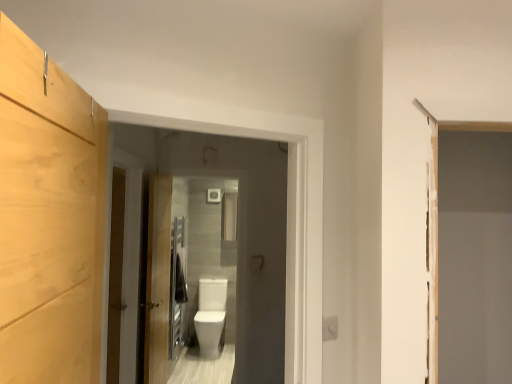
The image size is (512, 384). What do you see at coordinates (158, 279) in the screenshot? I see `wooden door at center, arranged as the first door when viewed from the back` at bounding box center [158, 279].

You are a GUI agent. You are given a task and a screenshot of the screen. Output one action in this format:
    pyautogui.click(x=<x>, y=<y>)
    Task: Click on the wooden door at center, the second door viewed from the left
    Image resolution: width=512 pixels, height=384 pixels.
    Given the screenshot: What is the action you would take?
    pyautogui.click(x=158, y=279)

Describe the element at coordinates (130, 260) in the screenshot. I see `wooden door at center, acting as the second door starting from the right` at that location.

What is the approximate width of wooden door at center, placed as the first door when sorted from left to right?

wooden door at center, placed as the first door when sorted from left to right, is 3.94 inches in width.

Image resolution: width=512 pixels, height=384 pixels. Describe the element at coordinates (238, 229) in the screenshot. I see `white glossy toilet at center` at that location.

Find the location of a particular element. The width and height of the screenshot is (512, 384). wooden door at center, arranged as the first door when viewed from the back is located at coordinates (158, 279).

Is wooden door at center, the first door positioned from the right, oriented away from light wood cabinet at left?

No, wooden door at center, the first door positioned from the right, is not facing away from light wood cabinet at left.

Measure the distance from wooden door at center, the second door viewed from the left, to light wood cabinet at left.

They are 2.21 meters apart.

Are wooden door at center, the first door positioned from the right, and light wood cabinet at left making contact?

No, wooden door at center, the first door positioned from the right, is not beside light wood cabinet at left.

Where is `cabinetry on the right of wooden door at center, the second door viewed from the left`? The image size is (512, 384). cabinetry on the right of wooden door at center, the second door viewed from the left is located at coordinates (49, 218).

Measure the distance from wooden door at center, the second door viewed from the left, to white glossy toilet at center.

They are 23.95 inches apart.

From their relative heights in the image, would you say wooden door at center, arranged as the first door when viewed from the back, is taller or shorter than white glossy toilet at center?

In the image, wooden door at center, arranged as the first door when viewed from the back, appears to be taller than white glossy toilet at center.

From a real-world perspective, is wooden door at center, the second door viewed from the left, located beneath white glossy toilet at center?

Yes, from a real-world perspective, wooden door at center, the second door viewed from the left, is below white glossy toilet at center.

Could you tell me if wooden door at center, the second door viewed from the left, is facing white glossy toilet at center?

No, wooden door at center, the second door viewed from the left, is not oriented towards white glossy toilet at center.

Who is shorter, light wood cabinet at left or wooden door at center, acting as the second door starting from the right?

light wood cabinet at left.

Is light wood cabinet at left thinner than wooden door at center, acting as the 1th door starting from the front?

Incorrect, the width of light wood cabinet at left is not less than that of wooden door at center, acting as the 1th door starting from the front.

Considering the sizes of light wood cabinet at left and wooden door at center, which appears as the second door when viewed from the back, in the image, is light wood cabinet at left bigger or smaller than wooden door at center, which appears as the second door when viewed from the back,?

light wood cabinet at left is smaller than wooden door at center, which appears as the second door when viewed from the back.

In terms of height, does wooden door at center, placed as the first door when sorted from left to right, look taller or shorter compared to wooden door at center, which is counted as the second door, starting from the front?

In the image, wooden door at center, placed as the first door when sorted from left to right, appears to be shorter than wooden door at center, which is counted as the second door, starting from the front.

Could you tell me if wooden door at center, acting as the second door starting from the right, is facing wooden door at center, which is counted as the second door, starting from the front?

No.

Looking at the image, does wooden door at center, which appears as the second door when viewed from the back, seem bigger or smaller compared to wooden door at center, arranged as the first door when viewed from the back?

wooden door at center, which appears as the second door when viewed from the back, is smaller than wooden door at center, arranged as the first door when viewed from the back.

Which point is more distant from viewer, [137,194] or [161,371]?

The point [161,371] is farther from the camera.

Considering the positions of point (20, 247) and point (212, 332), is point (20, 247) closer or farther from the camera than point (212, 332)?

Point (20, 247) is positioned closer to the camera compared to point (212, 332).

Considering the relative sizes of light wood cabinet at left and white glossy toilet bowl at center in the image provided, is light wood cabinet at left smaller than white glossy toilet bowl at center?

Yes, light wood cabinet at left is smaller than white glossy toilet bowl at center.

From a real-world perspective, which is physically above, light wood cabinet at left or white glossy toilet bowl at center?

light wood cabinet at left.

Is light wood cabinet at left not near white glossy toilet bowl at center?

Yes, light wood cabinet at left is far from white glossy toilet bowl at center.

Is wooden door at center, arranged as the first door when viewed from the back, completely or partially outside of wooden barn door at left?

That's correct, wooden door at center, arranged as the first door when viewed from the back, is outside of wooden barn door at left.

Is wooden door at center, arranged as the first door when viewed from the back, at the right side of wooden barn door at left?

Yes, wooden door at center, arranged as the first door when viewed from the back, is to the right of wooden barn door at left.

Which is in front, wooden door at center, the first door positioned from the right, or wooden barn door at left?

Positioned in front is wooden barn door at left.

Which is more to the left, white glossy toilet at center or wooden barn door at left?

wooden barn door at left is more to the left.

Consider the image. From the image's perspective, which one is positioned higher, white glossy toilet at center or wooden barn door at left?

white glossy toilet at center appears higher in the image.

From a real-world perspective, is white glossy toilet at center positioned above or below wooden barn door at left?

white glossy toilet at center is situated higher than wooden barn door at left in the real world.

Consider the image. Is white glossy toilet at center aimed at wooden barn door at left?

No, white glossy toilet at center is not facing towards wooden barn door at left.

Where is `the 1st door to the left of the light wood cabinet at left, starting your count from the anchor`? the 1st door to the left of the light wood cabinet at left, starting your count from the anchor is located at coordinates (158, 279).

Locate an element on the screen. screen door above the wooden door at center, the second door viewed from the left (from the image's perspective) is located at coordinates (238, 229).

Which object lies nearer to the anchor point light wood cabinet at left, wooden door at center, arranged as the first door when viewed from the back, or white glossy toilet at center?

white glossy toilet at center is closer to light wood cabinet at left.

Estimate the real-world distances between objects in this image. Which object is further from wooden door at center, the second door viewed from the left, white glossy toilet bowl at center or light wood cabinet at left?

light wood cabinet at left is positioned further to the anchor wooden door at center, the second door viewed from the left.

Looking at the image, which one is located closer to wooden door at center, acting as the second door starting from the right, wooden barn door at left or white glossy toilet at center?

Based on the image, wooden barn door at left appears to be nearer to wooden door at center, acting as the second door starting from the right.

Based on their spatial positions, is white glossy toilet at center or wooden door at center, which is counted as the second door, starting from the front, further from light wood cabinet at left?

Based on the image, wooden door at center, which is counted as the second door, starting from the front, appears to be further to light wood cabinet at left.

Estimate the real-world distances between objects in this image. Which object is closer to light wood cabinet at left, wooden barn door at left or white glossy toilet at center?

Based on the image, wooden barn door at left appears to be nearer to light wood cabinet at left.

Estimate the real-world distances between objects in this image. Which object is further from white glossy toilet bowl at center, wooden door at center, which is counted as the second door, starting from the front, or white glossy toilet at center?

The object further to white glossy toilet bowl at center is white glossy toilet at center.

Considering their positions, is wooden door at center, the first door positioned from the right, positioned closer to light wood cabinet at left than white glossy toilet bowl at center?

Among the two, wooden door at center, the first door positioned from the right, is located nearer to light wood cabinet at left.

When comparing their distances from wooden barn door at left, does wooden door at center, which appears as the second door when viewed from the back, or white glossy toilet bowl at center seem closer?

Based on the image, wooden door at center, which appears as the second door when viewed from the back, appears to be nearer to wooden barn door at left.

Locate an element on the screen. The height and width of the screenshot is (384, 512). barn door between wooden door at center, acting as the second door starting from the right, and white glossy toilet bowl at center from front to back is located at coordinates (115, 275).

You are a GUI agent. You are given a task and a screenshot of the screen. Output one action in this format:
    pyautogui.click(x=<x>, y=<y>)
    Task: Click on the screen door positioned between light wood cabinet at left and wooden door at center, acting as the second door starting from the right, from near to far
    The width and height of the screenshot is (512, 384).
    Given the screenshot: What is the action you would take?
    pyautogui.click(x=238, y=229)

Where is `screen door positioned between light wood cabinet at left and wooden door at center, the first door positioned from the right, from near to far`? This screenshot has width=512, height=384. screen door positioned between light wood cabinet at left and wooden door at center, the first door positioned from the right, from near to far is located at coordinates 238,229.

Find the location of a particular element. barn door located between light wood cabinet at left and white glossy toilet bowl at center in the depth direction is located at coordinates (115, 275).